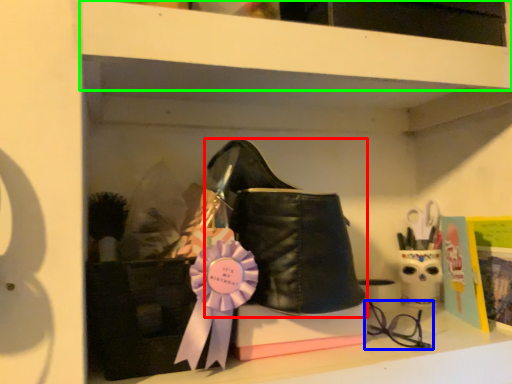
Question: Which is farther away from footwear (highlighted by a red box)? glasses (highlighted by a blue box) or shelf (highlighted by a green box)?

Choices:
 (A) glasses
 (B) shelf

Answer: (A)